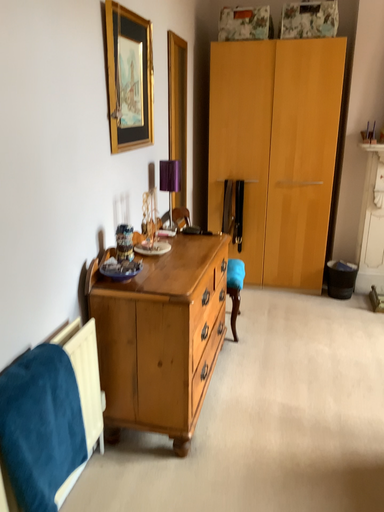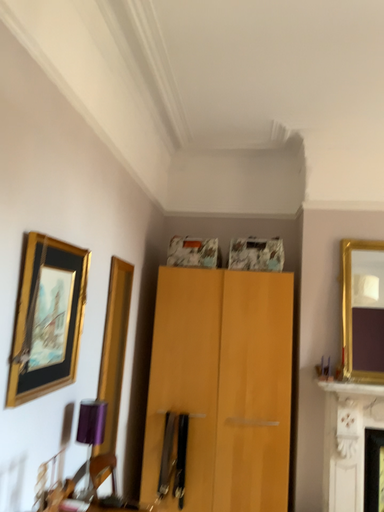
Question: Which way did the camera rotate in the video?

Choices:
 (A) rotated downward
 (B) rotated upward

Answer: (B)